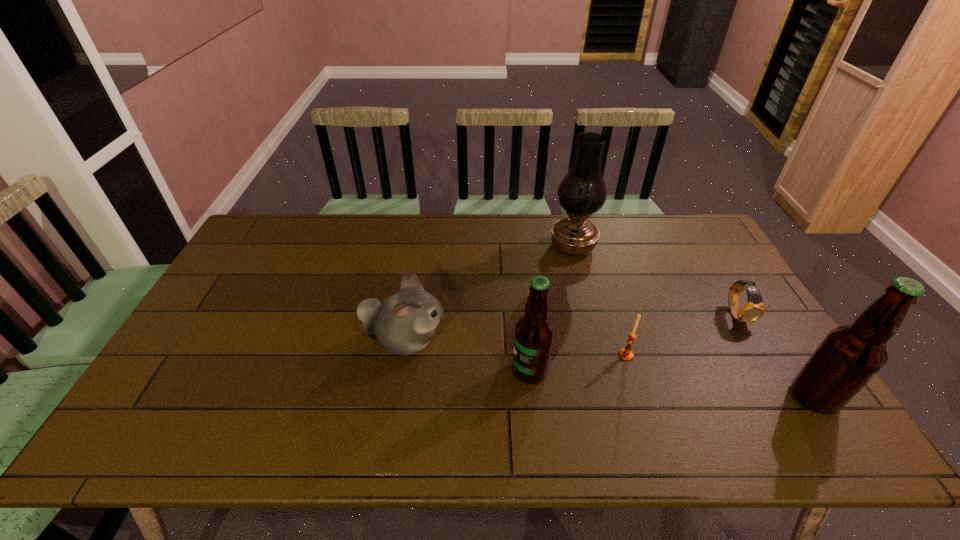
The image size is (960, 540). Identify the location of vacant point located between the right beer bottle and the left beer bottle. (672, 384).

Locate an element on the screen. free space between the third tallest object and the taller beer bottle is located at coordinates (672, 384).

Find the location of a particular element. vacant region between the candle_holder and the right beer bottle is located at coordinates (720, 376).

You are a GUI agent. You are given a task and a screenshot of the screen. Output one action in this format:
    pyautogui.click(x=<x>, y=<y>)
    Task: Click on the object that stands as the fifth closest to the right beer bottle
    The width and height of the screenshot is (960, 540).
    Given the screenshot: What is the action you would take?
    pyautogui.click(x=403, y=323)

Find the location of `object that stands as the second closest to the third tallest object`. object that stands as the second closest to the third tallest object is located at coordinates (626, 354).

You are a GUI agent. You are given a task and a screenshot of the screen. Output one action in this format:
    pyautogui.click(x=<x>, y=<y>)
    Task: Click on the vacant space that satisfies the following two spatial constraints: 1. on the face of the second shortest object; 2. on the left side of the fourth tallest object
    This screenshot has height=540, width=960.
    Given the screenshot: What is the action you would take?
    pyautogui.click(x=403, y=355)

The image size is (960, 540). What are the coordinates of `vacant area in the image that satisfies the following two spatial constraints: 1. on the front side of the fifth tallest object; 2. on the label of the shorter beer bottle` in the screenshot? It's located at (631, 371).